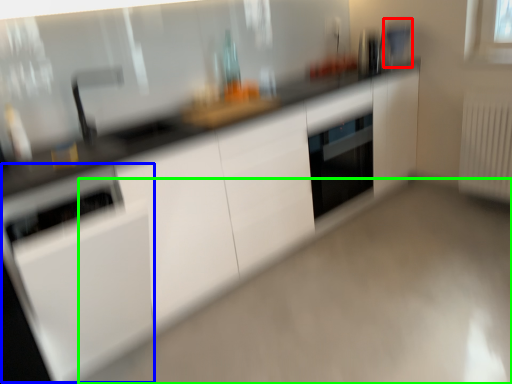
Question: Which object is positioned farthest from appliance (highlighted by a red box)? Select from appliance (highlighted by a blue box) and plain (highlighted by a green box).

Choices:
 (A) appliance
 (B) plain

Answer: (A)